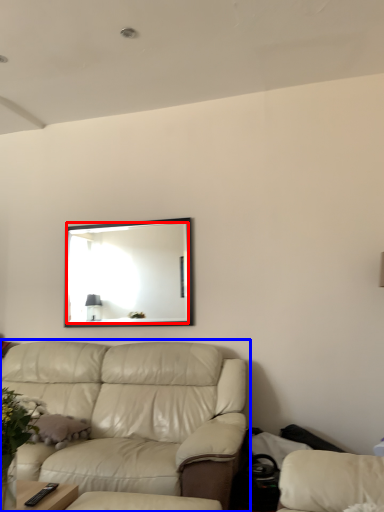
Question: Which object is further to the camera taking this photo, mirror (highlighted by a red box) or studio couch (highlighted by a blue box)?

Choices:
 (A) mirror
 (B) studio couch

Answer: (A)